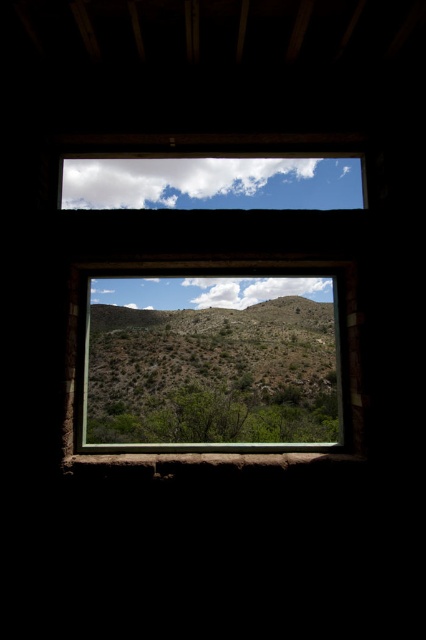
You are an interior designer assessing the lighting in a room with a rustic wooden frame at center and a green leafy tree at center. Based on the scene, which object would cast a shadow on the floor inside the room, and why?

The rustic wooden frame at center would cast a shadow on the floor inside the room because it is located above the green leafy tree at center, meaning it is closer to the light source coming through the window.

In the scene shown: You are an interior designer assessing the view from a window. The rustic wooden frame at center and the green leafy tree at center are both visible. Which object appears taller in the scene?

The rustic wooden frame at center appears taller than the green leafy tree at center because the rustic wooden frame at center has a greater height compared to green leafy tree at center.